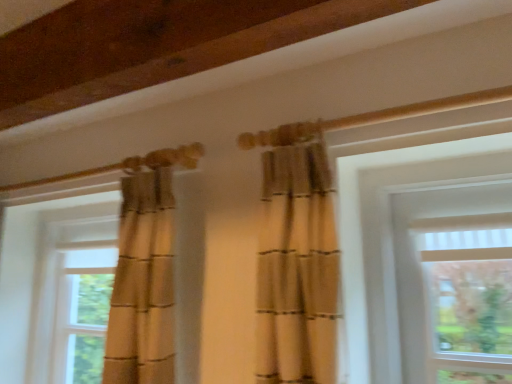
Question: From the image's perspective, is translucent glass window at left, arranged as the first window when viewed from the left, beneath matte beige curtain at left, the 1th window in the right-to-left sequence?

Choices:
 (A) yes
 (B) no

Answer: (A)

Question: Can you confirm if translucent glass window at left, arranged as the first window when viewed from the left, is taller than matte beige curtain at left, arranged as the second window when viewed from the left?

Choices:
 (A) no
 (B) yes

Answer: (A)

Question: Is the surface of translucent glass window at left, arranged as the first window when viewed from the left, in direct contact with matte beige curtain at left, the 1th window in the right-to-left sequence?

Choices:
 (A) yes
 (B) no

Answer: (B)

Question: Is translucent glass window at left, arranged as the first window when viewed from the left, behind matte beige curtain at left, the 1th window in the right-to-left sequence?

Choices:
 (A) yes
 (B) no

Answer: (A)

Question: Can you confirm if translucent glass window at left, arranged as the first window when viewed from the left, is bigger than matte beige curtain at left, arranged as the second window when viewed from the left?

Choices:
 (A) no
 (B) yes

Answer: (A)

Question: Is translucent glass window at left, arranged as the first window when viewed from the left, closer to the viewer compared to matte beige curtain at left, arranged as the second window when viewed from the left?

Choices:
 (A) yes
 (B) no

Answer: (B)

Question: Is matte beige curtain at left, arranged as the second window when viewed from the left, outside of translucent glass window at left, arranged as the first window when viewed from the left?

Choices:
 (A) no
 (B) yes

Answer: (B)

Question: From a real-world perspective, is matte beige curtain at left, the 1th window in the right-to-left sequence, under translucent glass window at left, arranged as the first window when viewed from the left?

Choices:
 (A) no
 (B) yes

Answer: (A)

Question: Is the position of matte beige curtain at left, arranged as the second window when viewed from the left, less distant than that of translucent glass window at left, the 2th window viewed from the right?

Choices:
 (A) yes
 (B) no

Answer: (A)

Question: From the image's perspective, is matte beige curtain at left, arranged as the second window when viewed from the left, on translucent glass window at left, the 2th window viewed from the right?

Choices:
 (A) no
 (B) yes

Answer: (B)

Question: Can you confirm if matte beige curtain at left, the 1th window in the right-to-left sequence, is taller than translucent glass window at left, arranged as the first window when viewed from the left?

Choices:
 (A) no
 (B) yes

Answer: (B)

Question: Does matte beige curtain at left, arranged as the second window when viewed from the left, come behind translucent glass window at left, the 2th window viewed from the right?

Choices:
 (A) no
 (B) yes

Answer: (A)

Question: Looking at their shapes, would you say matte beige curtain at left, arranged as the second window when viewed from the left, is wider or thinner than translucent glass window at left, arranged as the first window when viewed from the left?

Choices:
 (A) wide
 (B) thin

Answer: (A)